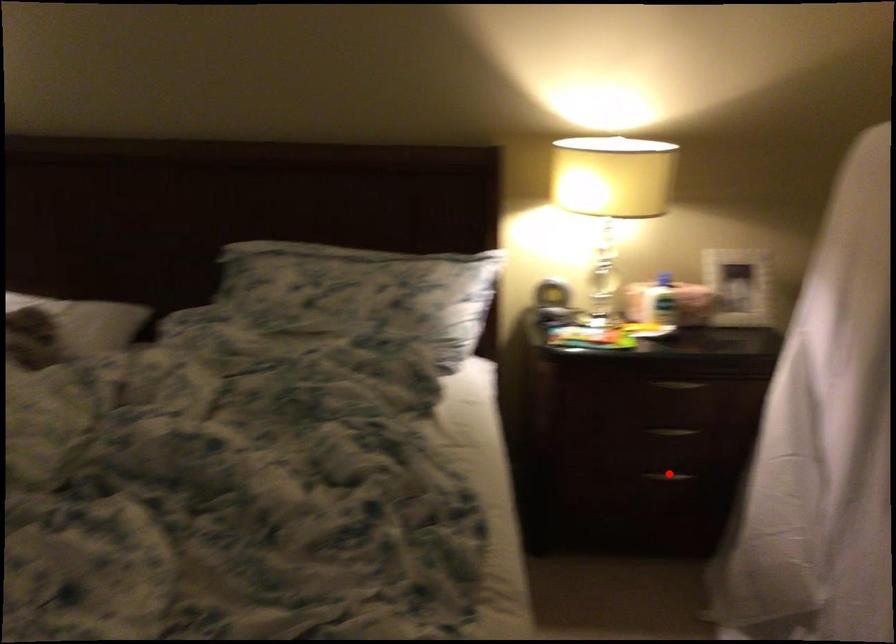
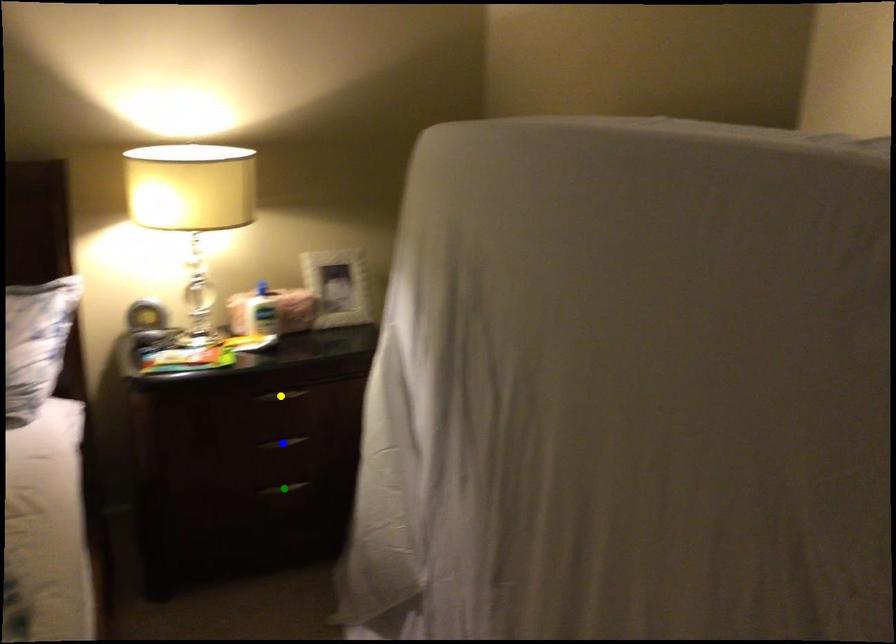
Question: I am providing you with two images of the same scene from different viewpoints. A red point is marked on the first image. You are given multiple points on the second image. In image 2, which mark is for the same physical point as the one in image 1?

Choices:
 (A) green point
 (B) blue point
 (C) yellow point

Answer: (A)